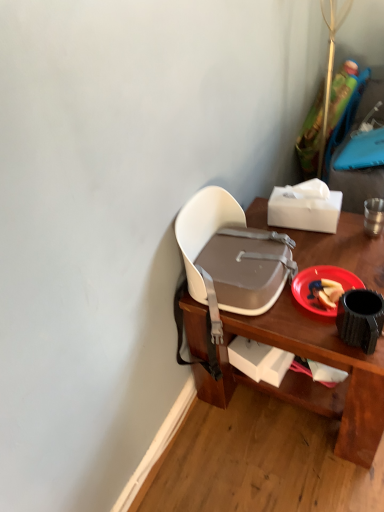
At what (x,y) coordinates should I click in order to perform the action: click on free space behind red plastic plate at lower right. Please return your answer as a coordinate pair (x, y). The height and width of the screenshot is (512, 384). Looking at the image, I should click on (323, 250).